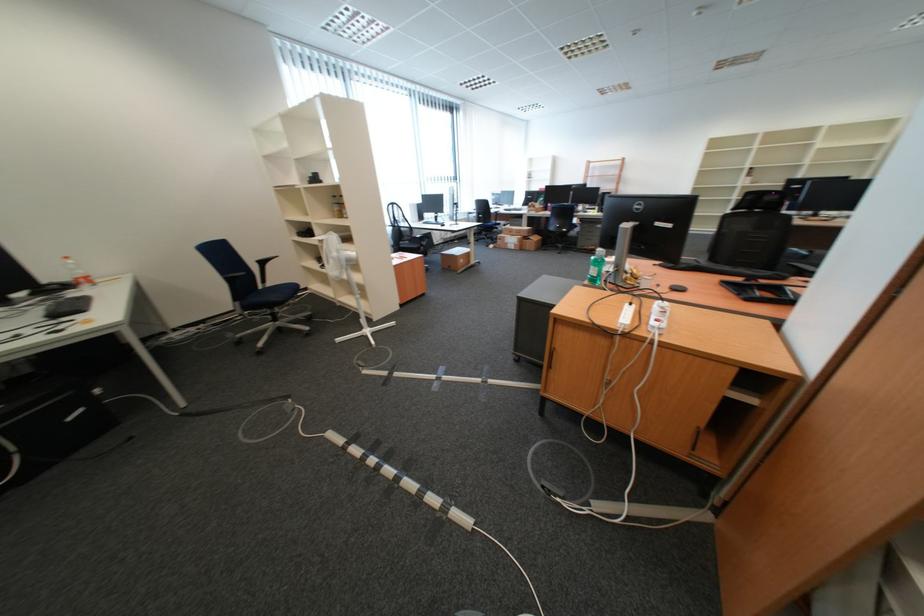
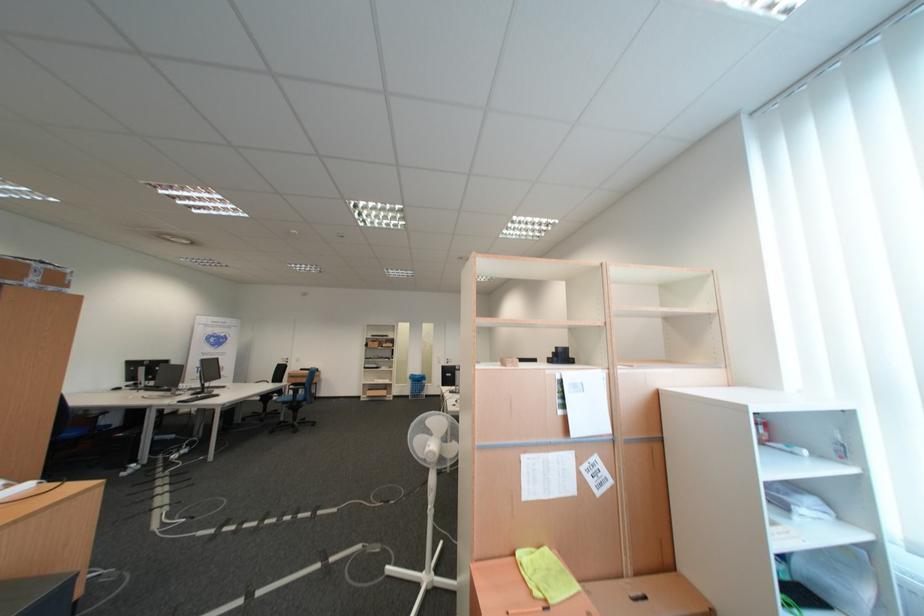
Locate, in the second image, the point that corresponds to pixel 380 331 in the first image.

(439, 578)